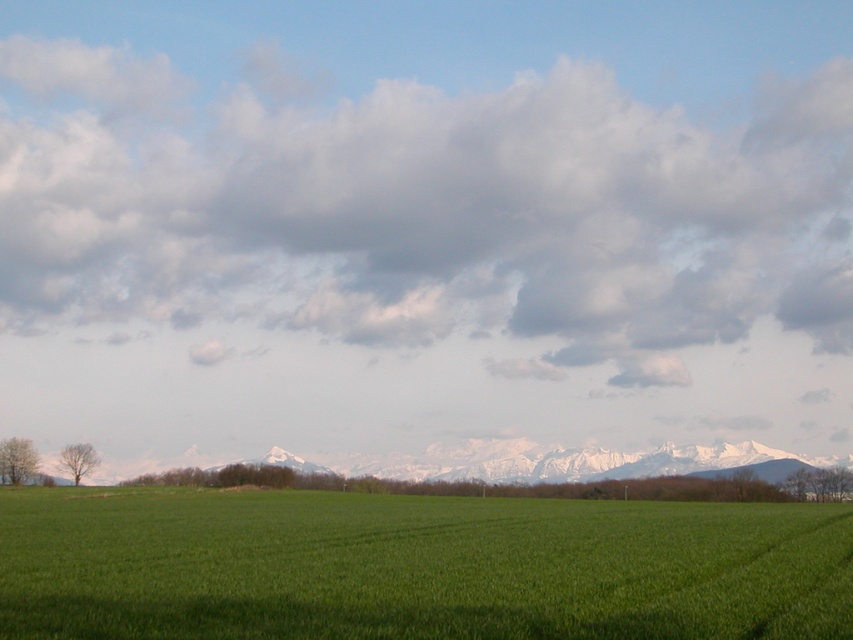
Based on the scene description, where is the cloudy sky at upper center located in terms of its 2D coordinates?

The cloudy sky at upper center is located at the 2D coordinates of point (427,212).

You are standing in the green fields and see two points marked in the image. Which point is closer to you, point (502, 195) or point (492, 467)?

Point (492, 467) is closer to you because it is in front of point (502, 195).